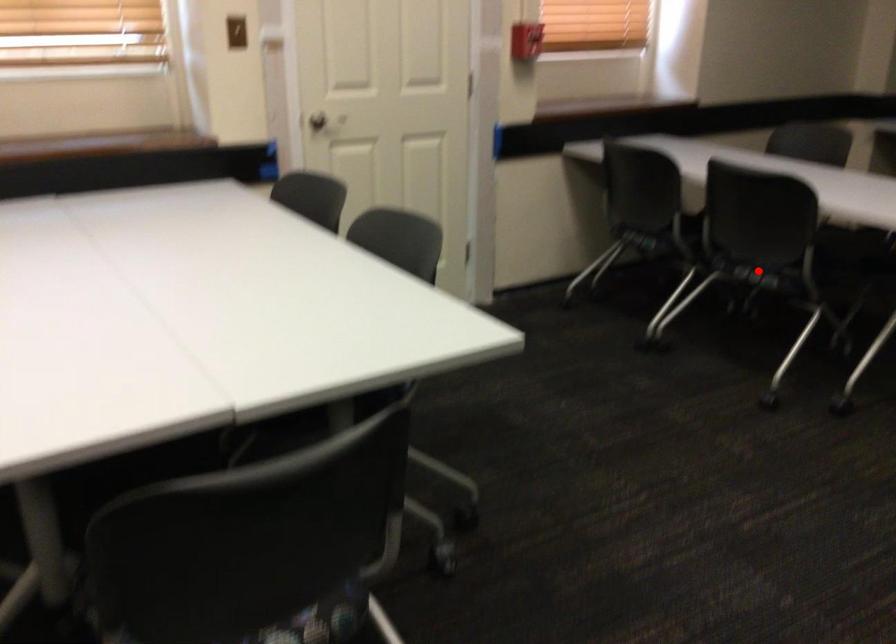
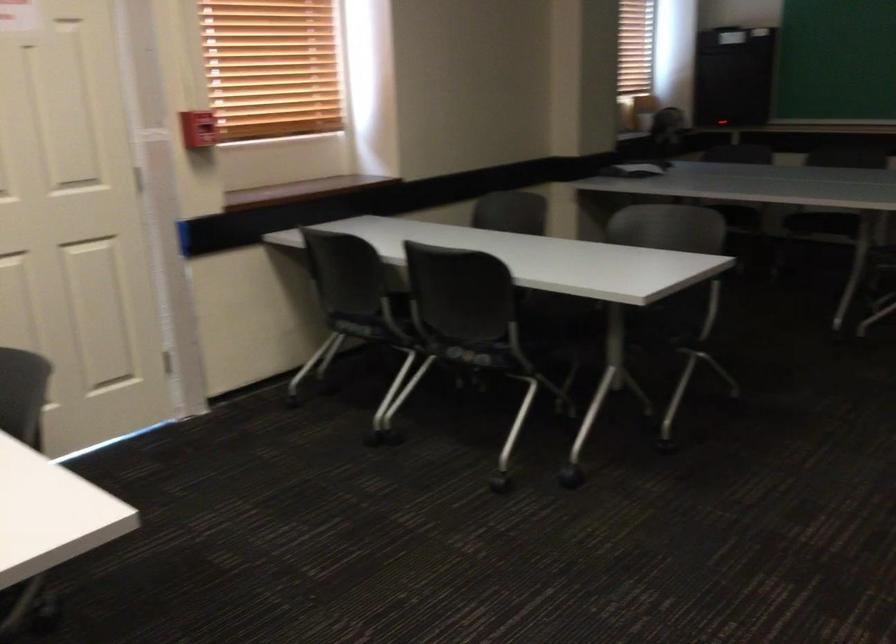
The point at the highlighted location is marked in the first image. Where is the corresponding point in the second image?

(474, 354)